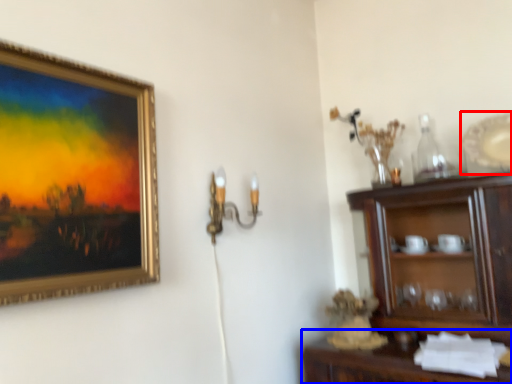
Question: Among these objects, which one is farthest to the camera, platter (highlighted by a red box) or cabinetry (highlighted by a blue box)?

Choices:
 (A) platter
 (B) cabinetry

Answer: (A)